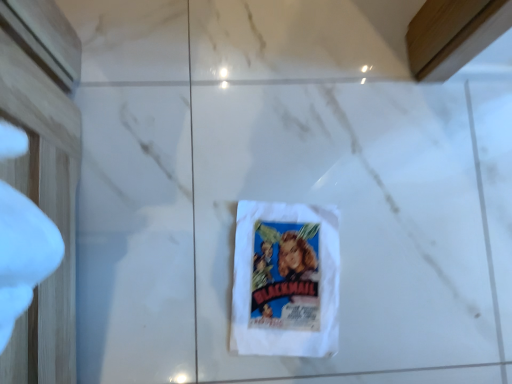
What is the approximate width of white paper bag at center?

The width of white paper bag at center is 29.63 centimeters.

What do you see at coordinates (285, 280) in the screenshot? Image resolution: width=512 pixels, height=384 pixels. I see `white paper bag at center` at bounding box center [285, 280].

Where is `white paper bag at center`? The height and width of the screenshot is (384, 512). white paper bag at center is located at coordinates (285, 280).

Locate an element on the screen. This screenshot has width=512, height=384. white paper bag at center is located at coordinates pyautogui.click(x=285, y=280).